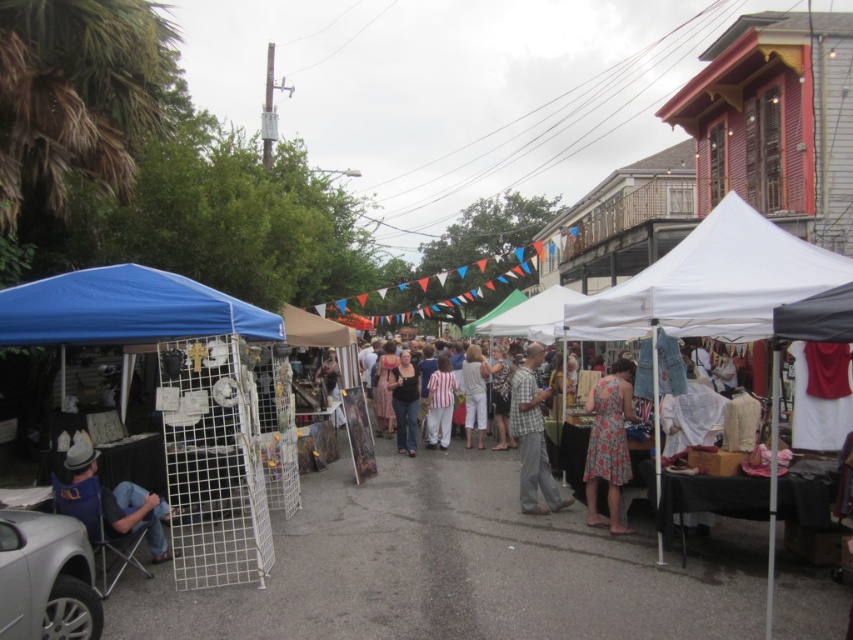
Question: Is white wire mesh cage at left smaller than striped fabric pants at center?

Choices:
 (A) no
 (B) yes

Answer: (A)

Question: Estimate the real-world distances between objects in this image. Which object is farther from the white wire mesh cage at left?

Choices:
 (A) white fabric canopy at center
 (B) blue fabric canopy at left

Answer: (A)

Question: Can you confirm if matte black shirt at center is bigger than white cotton pants at center?

Choices:
 (A) no
 (B) yes

Answer: (A)

Question: Among these points, which one is nearest to the camera?

Choices:
 (A) (531, 481)
 (B) (618, 371)
 (C) (473, 346)

Answer: (B)

Question: Where is white fabric canopy at center located in relation to denim jeans at lower left in the image?

Choices:
 (A) above
 (B) below

Answer: (A)

Question: Which of the following is the farthest from the observer?

Choices:
 (A) (183, 486)
 (B) (258, 323)

Answer: (A)